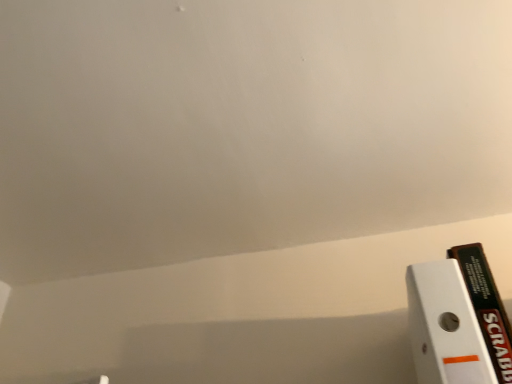
Describe the element at coordinates (486, 306) in the screenshot. Image resolution: width=512 pixels, height=384 pixels. I see `black cardboard book at right` at that location.

Identify the location of black cardboard book at right. The width and height of the screenshot is (512, 384). (486, 306).

Describe the element at coordinates (445, 327) in the screenshot. I see `white matte paper at lower right` at that location.

Locate an element on the screen. The image size is (512, 384). white matte paper at lower right is located at coordinates (445, 327).

Measure the distance between point (x=467, y=352) and camera.

Point (x=467, y=352) is 23.11 inches away from camera.

At what (x,y) coordinates should I click in order to perform the action: click on black cardboard book at right. Please return your answer as a coordinate pair (x, y). The image size is (512, 384). Looking at the image, I should click on (486, 306).

Based on their positions, is black cardboard book at right located to the left or right of white matte paper at lower right?

black cardboard book at right is positioned on white matte paper at lower right's right side.

Is black cardboard book at right in front of white matte paper at lower right?

No, it is behind white matte paper at lower right.

Is point (468, 257) closer or farther from the camera than point (447, 306)?

Point (468, 257) appears to be farther away from the viewer than point (447, 306).

From the image's perspective, is black cardboard book at right positioned above or below white matte paper at lower right?

black cardboard book at right is below white matte paper at lower right.

From the picture: From a real-world perspective, which is physically above, black cardboard book at right or white matte paper at lower right?

black cardboard book at right.

Is black cardboard book at right wider or thinner than white matte paper at lower right?

Clearly, black cardboard book at right has more width compared to white matte paper at lower right.

In the scene shown: Who is taller, black cardboard book at right or white matte paper at lower right?

With more height is black cardboard book at right.

Who is smaller, black cardboard book at right or white matte paper at lower right?

white matte paper at lower right.

Would you say black cardboard book at right is outside white matte paper at lower right?

Yes, black cardboard book at right is located beyond the bounds of white matte paper at lower right.

Is black cardboard book at right with white matte paper at lower right?

Absolutely, black cardboard book at right is next to and touching white matte paper at lower right.

Is black cardboard book at right facing towards white matte paper at lower right?

No, black cardboard book at right is not oriented towards white matte paper at lower right.

Measure the distance between black cardboard book at right and white matte paper at lower right.

They are 2.42 inches apart.

I want to click on paperback book located above the black cardboard book at right (from the image's perspective), so click(445, 327).

Can you confirm if white matte paper at lower right is positioned to the left of black cardboard book at right?

Yes, white matte paper at lower right is to the left of black cardboard book at right.

In the image, is white matte paper at lower right positioned in front of or behind black cardboard book at right?

Visually, white matte paper at lower right is located in front of black cardboard book at right.

Does point (469, 321) appear closer or farther from the camera than point (496, 342)?

Clearly, point (469, 321) is closer to the camera than point (496, 342).

From the image's perspective, does white matte paper at lower right appear lower than black cardboard book at right?

Actually, white matte paper at lower right appears above black cardboard book at right in the image.

From a real-world perspective, is white matte paper at lower right above or below black cardboard book at right?

Clearly, from a real-world perspective, white matte paper at lower right is below black cardboard book at right.

Considering the sizes of objects white matte paper at lower right and black cardboard book at right in the image provided, who is wider, white matte paper at lower right or black cardboard book at right?

black cardboard book at right is wider.

Which of these two, white matte paper at lower right or black cardboard book at right, stands shorter?

white matte paper at lower right.

Which of these two, white matte paper at lower right or black cardboard book at right, is smaller?

white matte paper at lower right is smaller.

Is white matte paper at lower right positioned beyond the bounds of black cardboard book at right?

That's correct, white matte paper at lower right is outside of black cardboard book at right.

Are white matte paper at lower right and black cardboard book at right beside each other?

Yes, white matte paper at lower right is with black cardboard book at right.

Is white matte paper at lower right oriented away from black cardboard book at right?

white matte paper at lower right does not have its back to black cardboard book at right.

How different are the orientations of white matte paper at lower right and black cardboard book at right in degrees?

The facing directions of white matte paper at lower right and black cardboard book at right are 0.000611 degrees apart.

At what (x,y) coordinates should I click in order to perform the action: click on book that is on the right side of white matte paper at lower right. Please return your answer as a coordinate pair (x, y). The image size is (512, 384). Looking at the image, I should click on (486, 306).

You are a GUI agent. You are given a task and a screenshot of the screen. Output one action in this format:
    pyautogui.click(x=<x>, y=<y>)
    Task: Click on the book below the white matte paper at lower right (from the image's perspective)
    The width and height of the screenshot is (512, 384).
    Given the screenshot: What is the action you would take?
    pyautogui.click(x=486, y=306)

You are a GUI agent. You are given a task and a screenshot of the screen. Output one action in this format:
    pyautogui.click(x=<x>, y=<y>)
    Task: Click on the paperback book below the black cardboard book at right (from a real-world perspective)
    Image resolution: width=512 pixels, height=384 pixels.
    Given the screenshot: What is the action you would take?
    pyautogui.click(x=445, y=327)